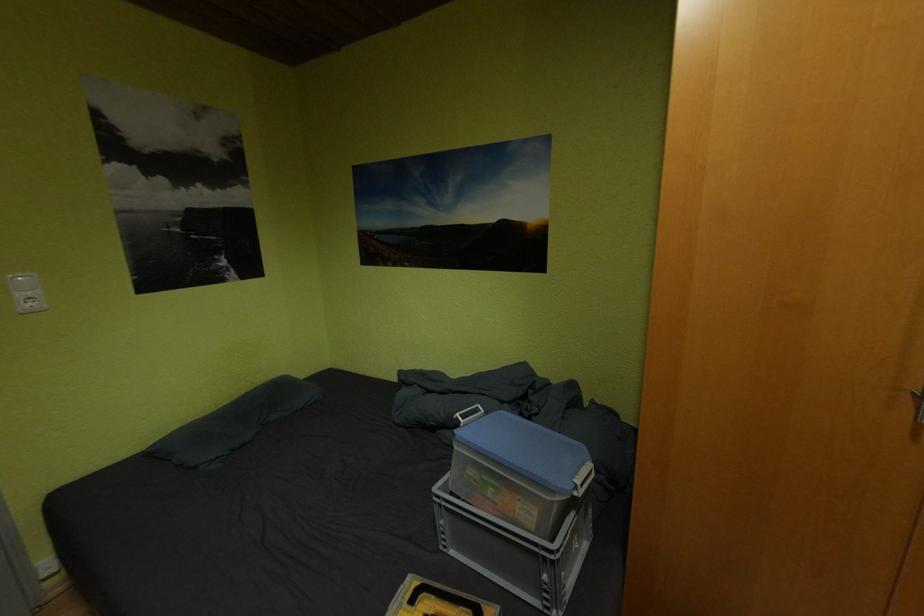
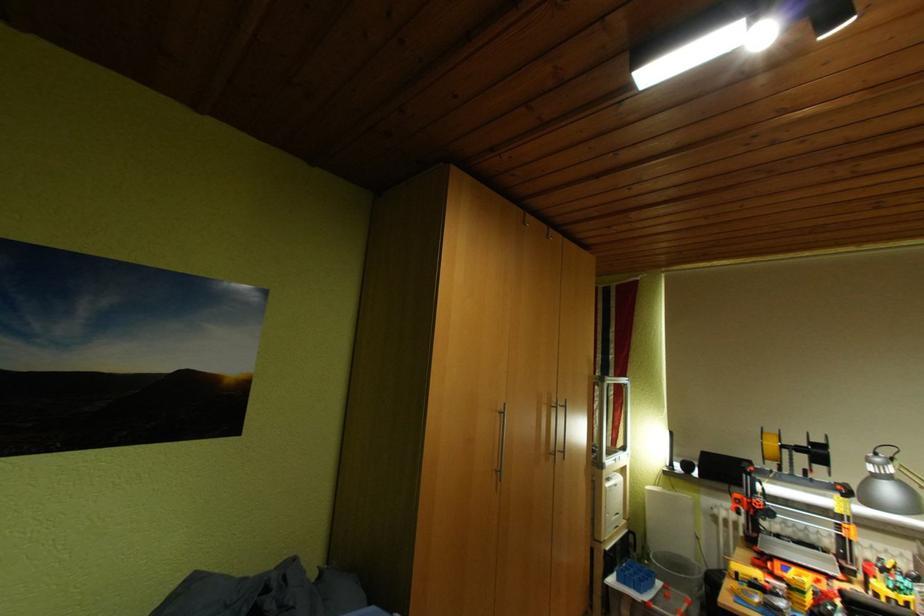
Question: The first image is from the beginning of the video and the second image is from the end. How did the camera likely rotate when shooting the video?

Choices:
 (A) Left
 (B) Right
 (C) Up
 (D) Down

Answer: (B)